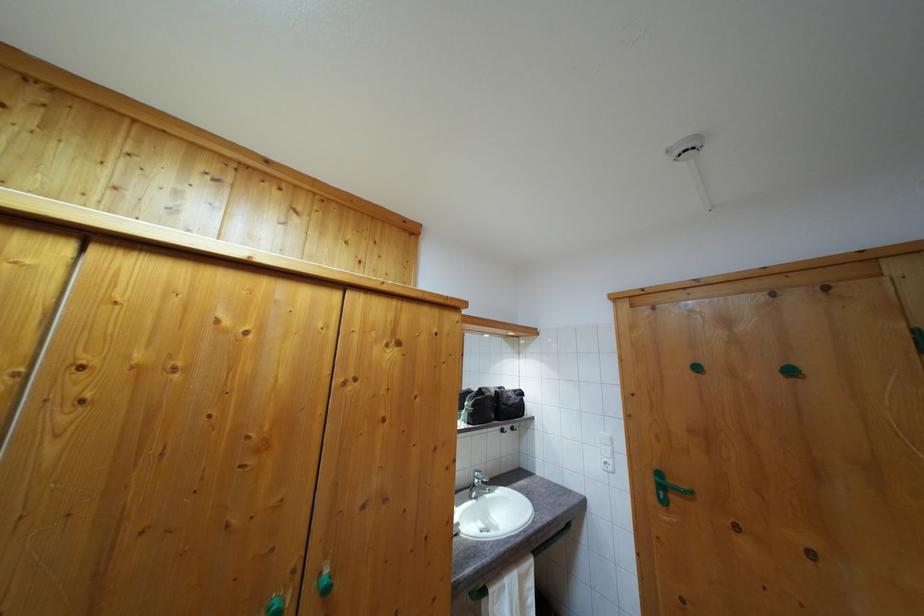
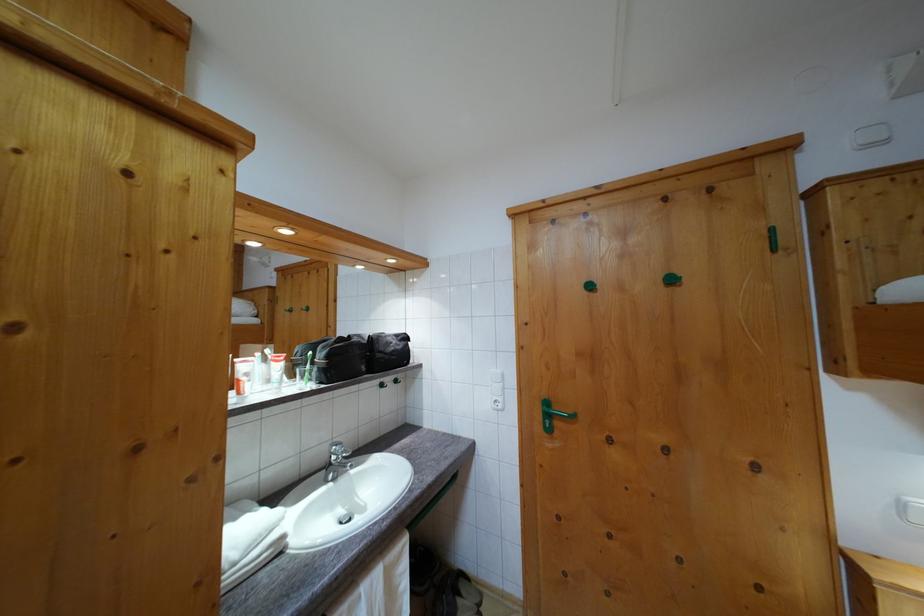
In the second image, find the point that corresponds to [613,456] in the first image.

(504, 392)